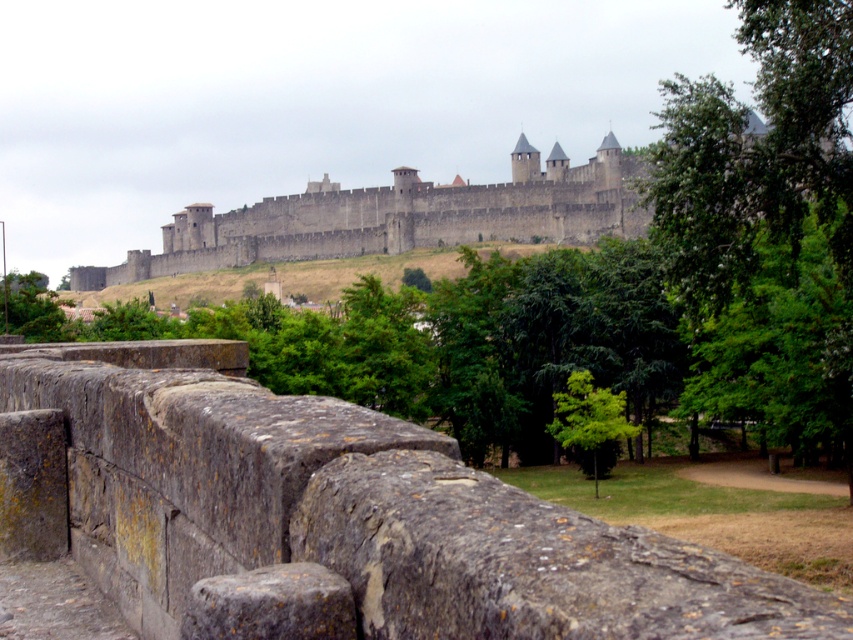
Does green leafy tree at upper right have a lesser width compared to green leafy tree at lower left?

Incorrect, green leafy tree at upper right's width is not less than green leafy tree at lower left's.

Between point (785, 369) and point (39, 337), which one is positioned behind?

Positioned behind is point (39, 337).

The image size is (853, 640). I want to click on green leafy tree at upper right, so click(764, 225).

I want to click on rusty stone ledge at center, so (328, 516).

Between rusty stone ledge at center and green leafy tree at center, which one has more height?

rusty stone ledge at center is taller.

Who is more distant from viewer, (248, 394) or (590, 461)?

The point (590, 461) is more distant.

I want to click on rusty stone ledge at center, so click(x=328, y=516).

Which is more to the left, green leafy tree at center or green leafy tree at lower left?

green leafy tree at lower left is more to the left.

Is green leafy tree at center bigger than green leafy tree at lower left?

Incorrect, green leafy tree at center is not larger than green leafy tree at lower left.

Where is `green leafy tree at center`? This screenshot has width=853, height=640. green leafy tree at center is located at coordinates (589, 417).

Locate an element on the screen. green leafy tree at center is located at coordinates (589, 417).